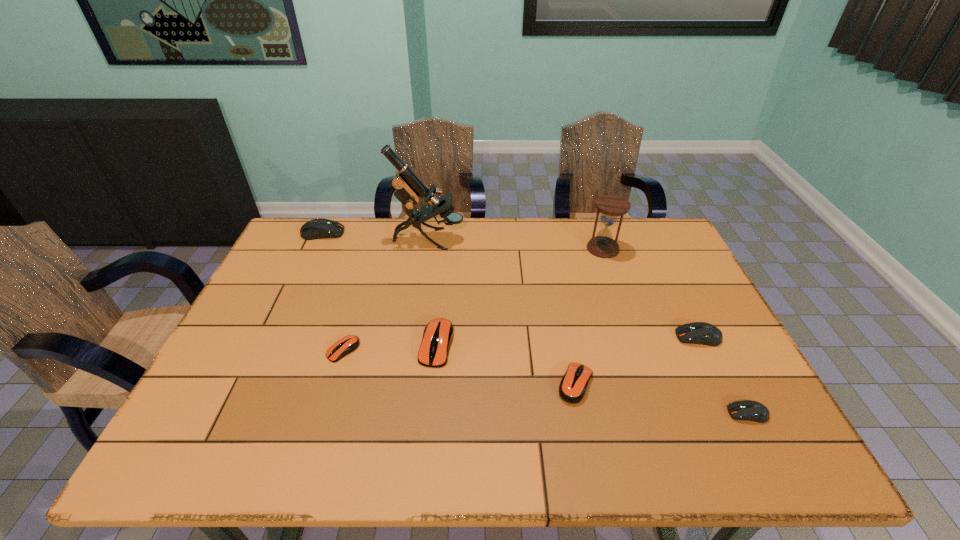
Locate an element on the screen. The image size is (960, 540). free spot that satisfies the following two spatial constraints: 1. on the back side of the seventh object from right to left; 2. on the right side of the second orange computer mouse from right to left is located at coordinates (345, 345).

You are a GUI agent. You are given a task and a screenshot of the screen. Output one action in this format:
    pyautogui.click(x=<x>, y=<y>)
    Task: Click on the free location that satisfies the following two spatial constraints: 1. on the back side of the second biggest orange computer mouse; 2. through the eyepiece of the microscope
    The height and width of the screenshot is (540, 960).
    Given the screenshot: What is the action you would take?
    pyautogui.click(x=547, y=239)

The image size is (960, 540). In order to click on free point that satisfies the following two spatial constraints: 1. on the back side of the third object from right to left; 2. on the button of the farthest computer mouse in this screenshot , I will do `click(598, 233)`.

Locate an element on the screen. Image resolution: width=960 pixels, height=540 pixels. free location that satisfies the following two spatial constraints: 1. through the eyepiece of the hourglass; 2. on the right side of the tallest object is located at coordinates (427, 248).